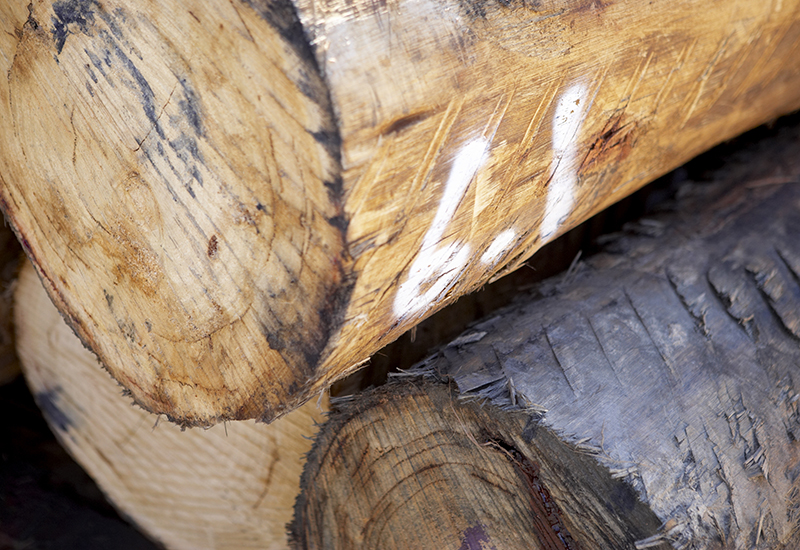
This screenshot has height=550, width=800. I want to click on light tan wood slice, so click(217, 504).